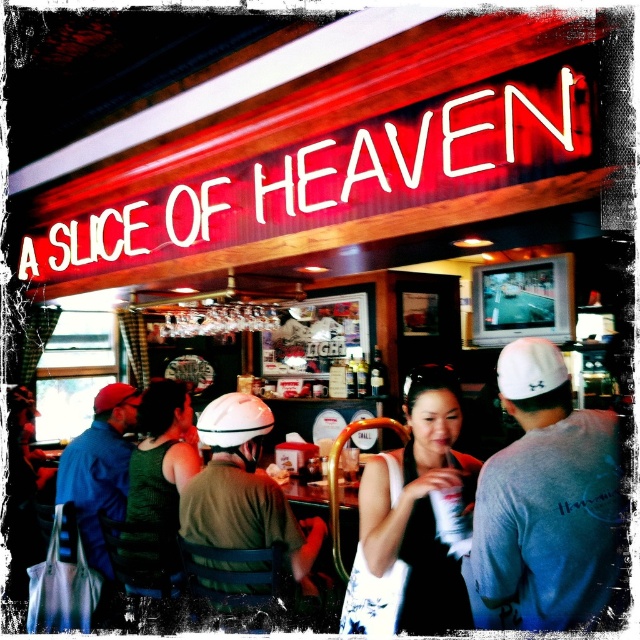
You are a bar patron who wants to place both the matte green helmet at center and the white matte baseball hat at center on the bar counter. Given that the counter has limited space, which item should you place first to ensure both fit comfortably?

The matte green helmet at center is bigger than the white matte baseball hat at center, so you should place the matte green helmet at center first to ensure both items fit comfortably on the counter.

You are a bar patron who wants to hang your hat on the coat rack behind the counter. Both the matte green helmet at center and the white matte baseball hat at center are currently on the counter. Which one takes up more vertical space and might need a taller hook?

The matte green helmet at center is taller than the white matte baseball hat at center, so it takes up more vertical space and would require a taller hook.

In the scene shown: You are a photographer at the bar and want to take a photo of the black fabric dress at center and the white fabric baseball cap at right. Since the dress is under the cap, will the cap block the view of the dress in the photo?

The black fabric dress at center is positioned under the white fabric baseball cap at right, so the cap will block part of the dress in the photo.